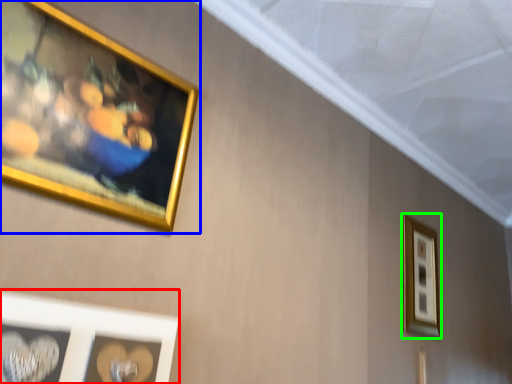
Question: Considering the real-world distances, which object is closest to picture frame (highlighted by a red box)? picture frame (highlighted by a blue box) or picture frame (highlighted by a green box).

Choices:
 (A) picture frame
 (B) picture frame

Answer: (A)